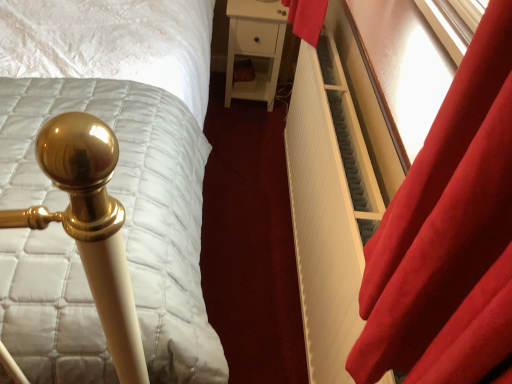
Question: Does velvet red curtain at right have a larger size compared to white ribbed radiator at right?

Choices:
 (A) yes
 (B) no

Answer: (B)

Question: Could you tell me if velvet red curtain at right is facing white ribbed radiator at right?

Choices:
 (A) yes
 (B) no

Answer: (B)

Question: From a real-world perspective, is velvet red curtain at right below white ribbed radiator at right?

Choices:
 (A) yes
 (B) no

Answer: (B)

Question: Is white ribbed radiator at right at the back of velvet red curtain at right?

Choices:
 (A) no
 (B) yes

Answer: (A)

Question: Would you say velvet red curtain at right is a long distance from white ribbed radiator at right?

Choices:
 (A) yes
 (B) no

Answer: (B)

Question: Considering the positions of white ribbed radiator at right and velvet red curtain at right in the image, is white ribbed radiator at right taller or shorter than velvet red curtain at right?

Choices:
 (A) short
 (B) tall

Answer: (B)

Question: From the image's perspective, is white ribbed radiator at right positioned above or below velvet red curtain at right?

Choices:
 (A) below
 (B) above

Answer: (A)

Question: Considering the positions of white ribbed radiator at right and velvet red curtain at right in the image, is white ribbed radiator at right wider or thinner than velvet red curtain at right?

Choices:
 (A) thin
 (B) wide

Answer: (A)

Question: Is white ribbed radiator at right inside the boundaries of velvet red curtain at right, or outside?

Choices:
 (A) inside
 (B) outside

Answer: (B)

Question: Considering their positions, is velvet red curtain at right located in front of or behind white ribbed radiator at right?

Choices:
 (A) behind
 (B) front

Answer: (B)

Question: Considering the positions of point (391, 276) and point (331, 369), is point (391, 276) closer or farther from the camera than point (331, 369)?

Choices:
 (A) closer
 (B) farther

Answer: (A)

Question: In terms of height, does velvet red curtain at right look taller or shorter compared to white ribbed radiator at right?

Choices:
 (A) short
 (B) tall

Answer: (A)

Question: Would you say velvet red curtain at right is inside or outside white ribbed radiator at right?

Choices:
 (A) outside
 (B) inside

Answer: (A)

Question: Is point (477, 61) positioned closer to the camera than point (66, 296)?

Choices:
 (A) farther
 (B) closer

Answer: (B)

Question: Looking at the image, does velvet red curtain at right seem bigger or smaller compared to gold metallic bedpost at left?

Choices:
 (A) big
 (B) small

Answer: (B)